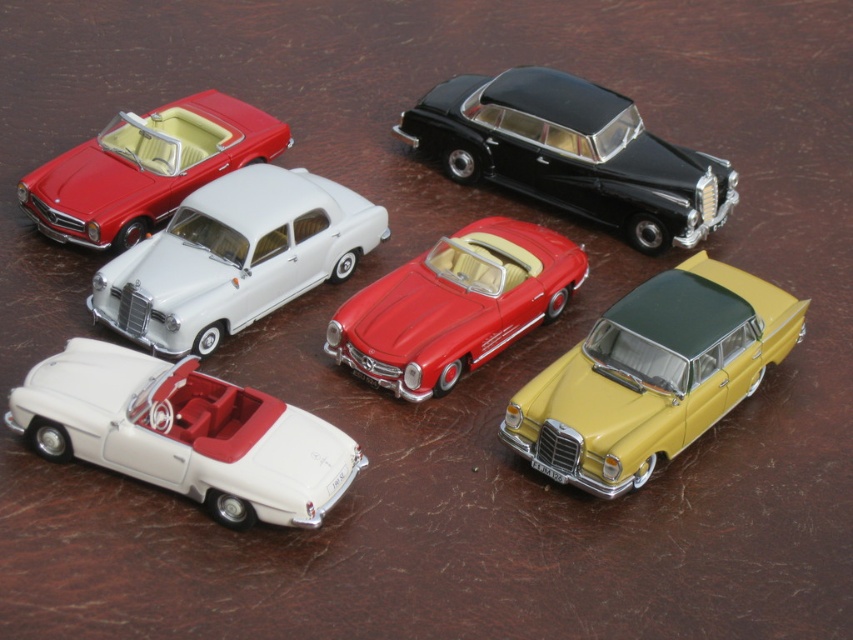
Between white matte convertible at lower left and black metallic sedan at upper right, which one appears on the right side from the viewer's perspective?

black metallic sedan at upper right is more to the right.

Looking at this image, between white matte convertible at lower left and black metallic sedan at upper right, which one is positioned higher?

black metallic sedan at upper right is above.

Is point (100, 388) positioned in front of point (630, 106)?

Yes, point (100, 388) is closer to viewer.

The image size is (853, 640). In order to click on white matte convertible at lower left in this screenshot , I will do `click(184, 433)`.

Who is lower down, yellow matte sedan at lower right or black metallic sedan at upper right?

yellow matte sedan at lower right is below.

Does point (686, 392) come closer to viewer compared to point (671, 157)?

Yes, it is.

This screenshot has height=640, width=853. Find the location of `yellow matte sedan at lower right`. yellow matte sedan at lower right is located at coordinates (651, 376).

Between shiny red convertible at center and matte white convertible at upper left, which one is positioned higher?

matte white convertible at upper left is above.

Between shiny red convertible at center and matte white convertible at upper left, which one is positioned lower?

shiny red convertible at center

At what (x,y) coordinates should I click in order to perform the action: click on shiny red convertible at center. Please return your answer as a coordinate pair (x, y). The height and width of the screenshot is (640, 853). Looking at the image, I should click on (456, 305).

Locate an element on the screen. Image resolution: width=853 pixels, height=640 pixels. shiny red convertible at center is located at coordinates (456, 305).